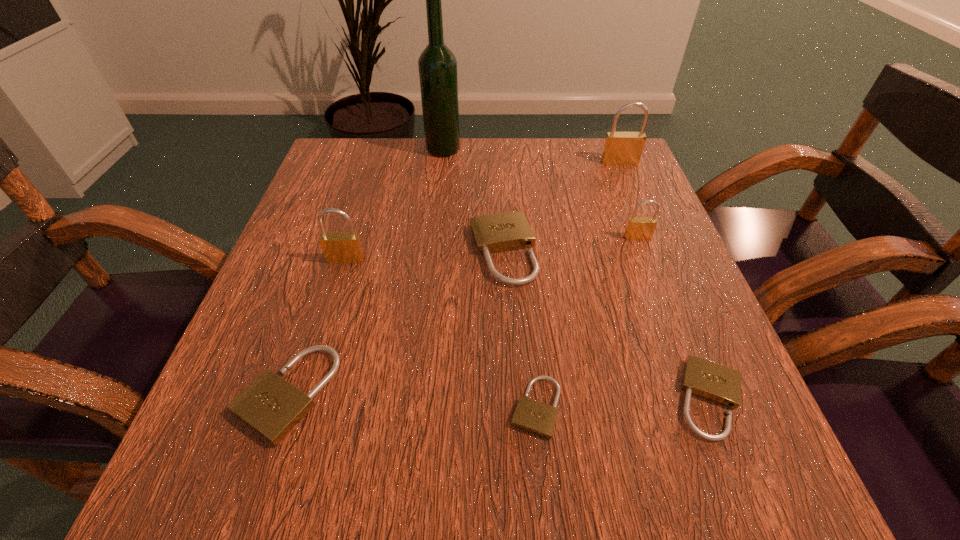
The image size is (960, 540). In order to click on the second biggest beige padlock in this screenshot , I will do `click(272, 407)`.

Where is `the third shortest object`? the third shortest object is located at coordinates (272, 407).

Where is `the rightmost beige padlock`? This screenshot has width=960, height=540. the rightmost beige padlock is located at coordinates (720, 384).

Identify the location of the second smallest beige padlock. [720, 384].

Locate an element on the screen. This screenshot has width=960, height=540. the smallest beige padlock is located at coordinates pyautogui.click(x=538, y=418).

At what (x,y) coordinates should I click in order to perform the action: click on the shortest padlock. Please return your answer as a coordinate pair (x, y). Looking at the image, I should click on (538, 418).

Identify the location of vacant area situated on the right of the tallest object. The width and height of the screenshot is (960, 540). (512, 150).

At what (x,y) coordinates should I click in order to perform the action: click on vacant space situated on the front-facing side of the farthest padlock. Please return your answer as a coordinate pair (x, y). Looking at the image, I should click on (665, 273).

Find the location of `vacant space located 0.180m on the front-facing side of the second tallest padlock`. vacant space located 0.180m on the front-facing side of the second tallest padlock is located at coordinates [x=320, y=344].

In order to click on free space located on the front-facing side of the second nearest brass padlock in this screenshot , I will do `click(663, 306)`.